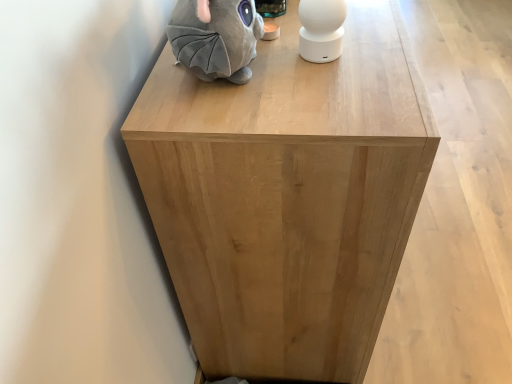
Question: Can you confirm if white matte speaker at upper center, which is counted as the first toy, starting from the right, is positioned to the right of natural wood cabinet at center?

Choices:
 (A) no
 (B) yes

Answer: (A)

Question: Is white matte speaker at upper center, which is counted as the first toy, starting from the right, placed right next to natural wood cabinet at center?

Choices:
 (A) no
 (B) yes

Answer: (A)

Question: From the image's perspective, does white matte speaker at upper center, which is counted as the first toy, starting from the right, appear lower than natural wood cabinet at center?

Choices:
 (A) no
 (B) yes

Answer: (B)

Question: Can you confirm if white matte speaker at upper center, the second toy positioned from the left, is shorter than natural wood cabinet at center?

Choices:
 (A) no
 (B) yes

Answer: (B)

Question: Is natural wood cabinet at center located within white matte speaker at upper center, the second toy positioned from the left?

Choices:
 (A) yes
 (B) no

Answer: (B)

Question: Is natural wood cabinet at center in front of or behind white matte speaker at upper center, the second toy positioned from the left, in the image?

Choices:
 (A) behind
 (B) front

Answer: (B)

Question: From the image's perspective, is natural wood cabinet at center located above or below white matte speaker at upper center, the second toy positioned from the left?

Choices:
 (A) below
 (B) above

Answer: (B)

Question: Does point (295, 177) appear closer or farther from the camera than point (324, 3)?

Choices:
 (A) closer
 (B) farther

Answer: (A)

Question: From a real-world perspective, is natural wood cabinet at center positioned above or below white matte speaker at upper center, which is counted as the first toy, starting from the right?

Choices:
 (A) above
 (B) below

Answer: (B)

Question: Considering their positions, is white matte speaker at upper center, the second toy positioned from the left, located in front of or behind gray plush toy at upper left, the first toy viewed from the left?

Choices:
 (A) front
 (B) behind

Answer: (B)

Question: From the image's perspective, relative to gray plush toy at upper left, marked as the 2th toy in a right-to-left arrangement, is white matte speaker at upper center, the second toy positioned from the left, above or below?

Choices:
 (A) below
 (B) above

Answer: (B)

Question: Is white matte speaker at upper center, the second toy positioned from the left, taller or shorter than gray plush toy at upper left, marked as the 2th toy in a right-to-left arrangement?

Choices:
 (A) short
 (B) tall

Answer: (A)

Question: From a real-world perspective, relative to gray plush toy at upper left, the first toy viewed from the left, is white matte speaker at upper center, the second toy positioned from the left, vertically above or below?

Choices:
 (A) below
 (B) above

Answer: (A)

Question: Is gray plush toy at upper left, the first toy viewed from the left, situated inside white matte speaker at upper center, which is counted as the first toy, starting from the right, or outside?

Choices:
 (A) inside
 (B) outside

Answer: (B)

Question: In the image, is gray plush toy at upper left, the first toy viewed from the left, positioned in front of or behind white matte speaker at upper center, which is counted as the first toy, starting from the right?

Choices:
 (A) behind
 (B) front

Answer: (B)